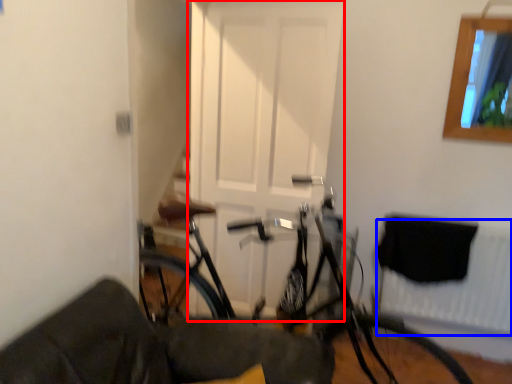
Question: Which point is closer to the camera, door (highlighted by a red box) or radiator (highlighted by a blue box)?

Choices:
 (A) door
 (B) radiator

Answer: (A)